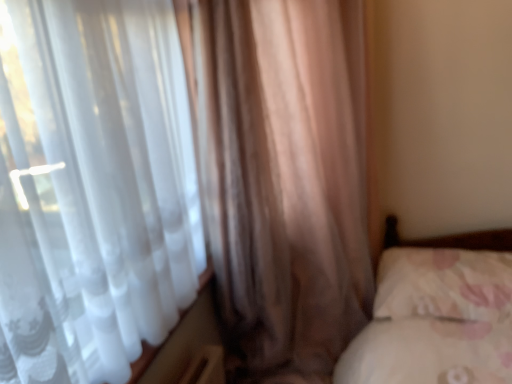
Question: Does fluffy white pillow at lower right have a smaller size compared to satin brown curtain at left, placed as the 1th curtain when sorted from left to right?

Choices:
 (A) yes
 (B) no

Answer: (A)

Question: From a real-world perspective, does fluffy white pillow at lower right sit lower than satin brown curtain at left, placed as the 1th curtain when sorted from left to right?

Choices:
 (A) no
 (B) yes

Answer: (B)

Question: Is satin brown curtain at left, the second curtain positioned from the right, completely or partially inside fluffy white pillow at lower right?

Choices:
 (A) no
 (B) yes

Answer: (A)

Question: Considering the relative positions of fluffy white pillow at lower right and satin brown curtain at left, placed as the 1th curtain when sorted from left to right, in the image provided, is fluffy white pillow at lower right to the right of satin brown curtain at left, placed as the 1th curtain when sorted from left to right, from the viewer's perspective?

Choices:
 (A) yes
 (B) no

Answer: (A)

Question: Is fluffy white pillow at lower right with satin brown curtain at left, the second curtain positioned from the right?

Choices:
 (A) yes
 (B) no

Answer: (B)

Question: Considering the relative sizes of fluffy white pillow at lower right and satin brown curtain at left, the second curtain positioned from the right, in the image provided, is fluffy white pillow at lower right bigger than satin brown curtain at left, the second curtain positioned from the right,?

Choices:
 (A) no
 (B) yes

Answer: (A)

Question: From the image's perspective, does translucent fabric curtain at left, the 2th curtain viewed from the left, appear higher than satin brown curtain at left, the second curtain positioned from the right?

Choices:
 (A) yes
 (B) no

Answer: (B)

Question: Considering the relative sizes of translucent fabric curtain at left, the first curtain when ordered from right to left, and satin brown curtain at left, the second curtain positioned from the right, in the image provided, is translucent fabric curtain at left, the first curtain when ordered from right to left, wider than satin brown curtain at left, the second curtain positioned from the right,?

Choices:
 (A) yes
 (B) no

Answer: (B)

Question: Considering the relative sizes of translucent fabric curtain at left, the first curtain when ordered from right to left, and satin brown curtain at left, placed as the 1th curtain when sorted from left to right, in the image provided, is translucent fabric curtain at left, the first curtain when ordered from right to left, taller than satin brown curtain at left, placed as the 1th curtain when sorted from left to right,?

Choices:
 (A) yes
 (B) no

Answer: (B)

Question: Is translucent fabric curtain at left, the 2th curtain viewed from the left, smaller than satin brown curtain at left, the second curtain positioned from the right?

Choices:
 (A) no
 (B) yes

Answer: (B)

Question: From a real-world perspective, is translucent fabric curtain at left, the 2th curtain viewed from the left, under satin brown curtain at left, the second curtain positioned from the right?

Choices:
 (A) no
 (B) yes

Answer: (A)

Question: Is translucent fabric curtain at left, the 2th curtain viewed from the left, oriented away from satin brown curtain at left, the second curtain positioned from the right?

Choices:
 (A) yes
 (B) no

Answer: (A)

Question: Does satin brown curtain at left, placed as the 1th curtain when sorted from left to right, come behind translucent fabric curtain at left, the 2th curtain viewed from the left?

Choices:
 (A) yes
 (B) no

Answer: (A)